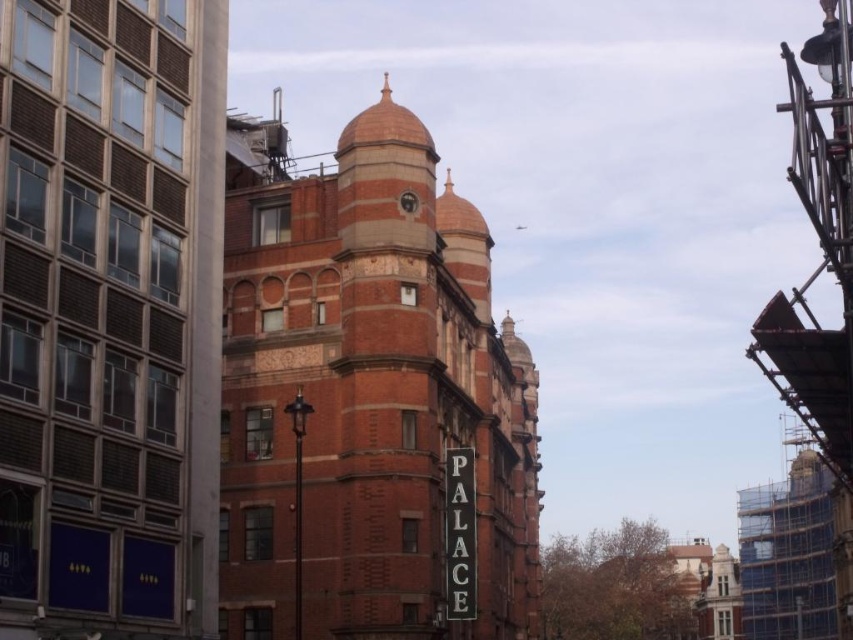
Between red brick building at center and brass metallic clock at center, which one has less height?

brass metallic clock at center

Does red brick building at center appear on the right side of brass metallic clock at center?

Correct, you'll find red brick building at center to the right of brass metallic clock at center.

This screenshot has width=853, height=640. What are the coordinates of `red brick building at center` in the screenshot? It's located at (368, 396).